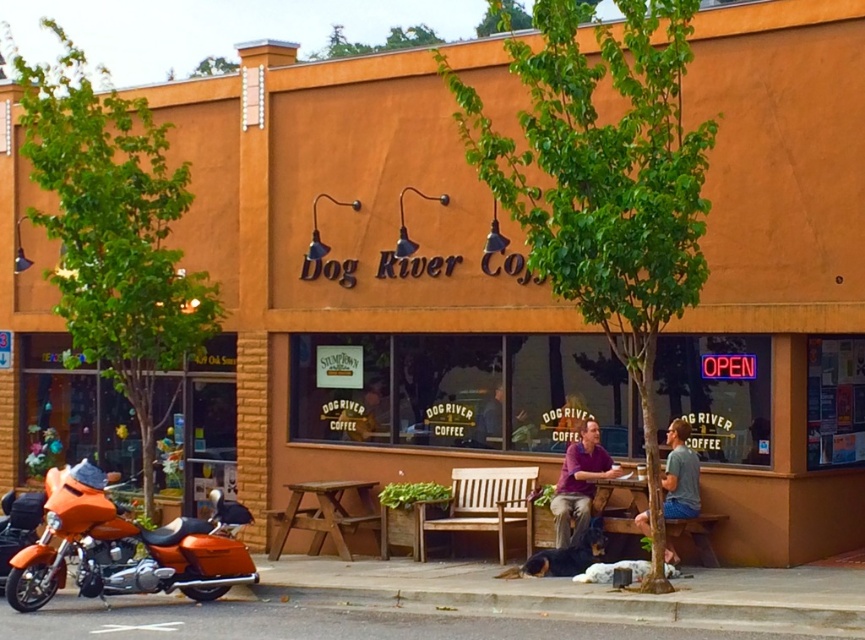
Question: Does orange matte motorcycle at lower left have a smaller size compared to gray cotton shirt at right?

Choices:
 (A) no
 (B) yes

Answer: (A)

Question: Among these objects, which one is farthest from the camera?

Choices:
 (A) purple matte shirt at center
 (B) light brown wooden bench at center

Answer: (B)

Question: Is the position of orange matte motorcycle at lower left more distant than that of gray cotton shirt at right?

Choices:
 (A) yes
 (B) no

Answer: (B)

Question: Which point is closer to the camera?

Choices:
 (A) (39, 595)
 (B) (661, 477)
 (C) (586, 506)

Answer: (A)

Question: Which of the following is the closest to the observer?

Choices:
 (A) purple matte shirt at center
 (B) gray cotton shirt at right
 (C) orange matte motorcycle at lower left
 (D) light brown wooden bench at center

Answer: (C)

Question: Observing the image, what is the correct spatial positioning of light brown wooden bench at center in reference to gray cotton shirt at right?

Choices:
 (A) below
 (B) above

Answer: (A)